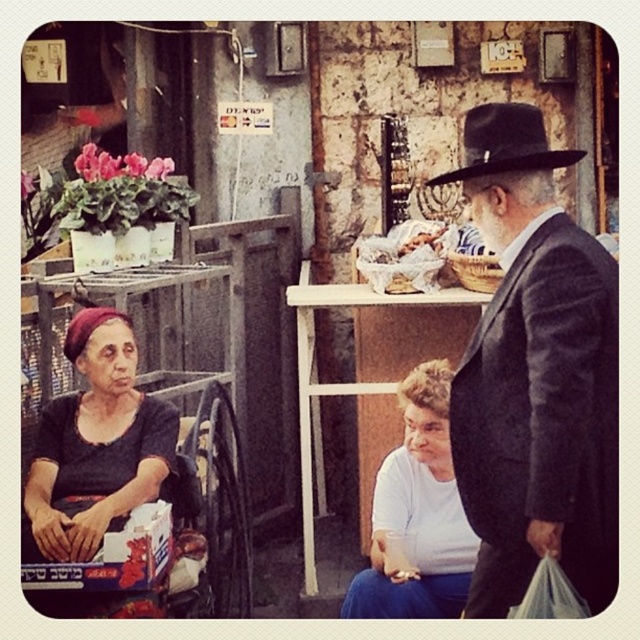
What do you see at coordinates (97, 442) in the screenshot? The image size is (640, 640). I see `dark gray fabric headscarf at lower left` at bounding box center [97, 442].

Who is positioned more to the left, dark gray fabric headscarf at lower left or white matte shirt at lower center?

dark gray fabric headscarf at lower left is more to the left.

Measure the distance between point (61, 529) and camera.

The distance of point (61, 529) from camera is 3.57 meters.

You are a GUI agent. You are given a task and a screenshot of the screen. Output one action in this format:
    pyautogui.click(x=<x>, y=<y>)
    Task: Click on the dark gray fabric headscarf at lower left
    This screenshot has height=640, width=640.
    Given the screenshot: What is the action you would take?
    pyautogui.click(x=97, y=442)

Is matte black suit at right further to camera compared to dark gray fabric headscarf at lower left?

No, matte black suit at right is closer to the viewer.

Identify the location of matte black suit at right. (536, 374).

Is point (483, 602) in front of point (106, 424)?

Yes.

At what (x,y) coordinates should I click in order to perform the action: click on matte black suit at right. Please return your answer as a coordinate pair (x, y). The height and width of the screenshot is (640, 640). Looking at the image, I should click on (536, 374).

From the picture: Does matte black suit at right have a greater height compared to black felt fedora at center?

Yes, matte black suit at right is taller than black felt fedora at center.

Which is more to the left, matte black suit at right or black felt fedora at center?

black felt fedora at center

Is point (566, 276) behind point (449, 172)?

No, it is in front of (449, 172).

Locate an element on the screen. The height and width of the screenshot is (640, 640). matte black suit at right is located at coordinates (536, 374).